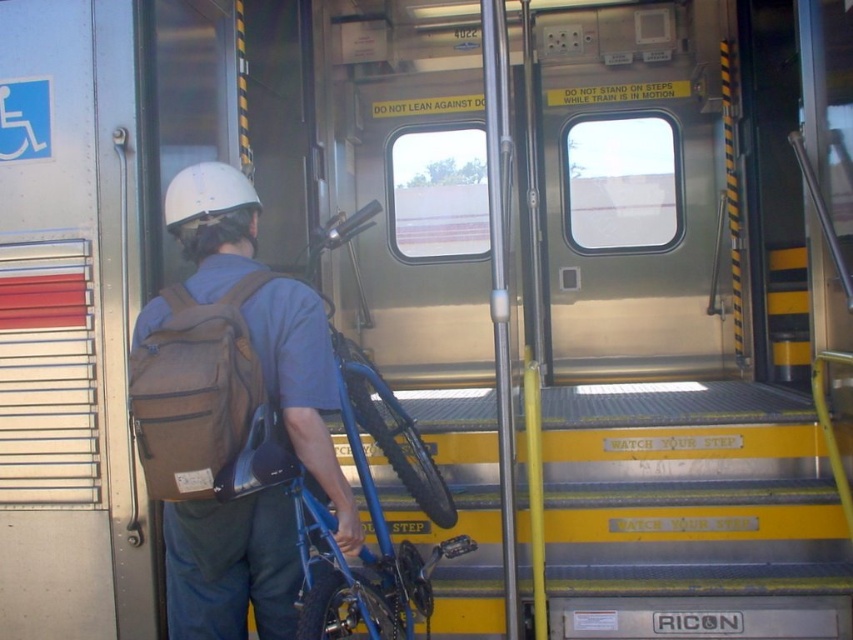
In the scene shown: You are a train conductor checking the boarding area. You notice the brown fabric backpack at left and the blue metallic bicycle at center. Which object is shorter in height?

The brown fabric backpack at left is not as tall as the blue metallic bicycle at center, so the brown fabric backpack at left is shorter in height.

You are standing at the train entrance and want to know how far the point at coordinates (253, 401) is from your current position. Based on the image, can you determine the distance?

The point at coordinates (253, 401) is 7.61 feet away from the camera, so the distance from your current position at the train entrance would be approximately 7.61 feet.